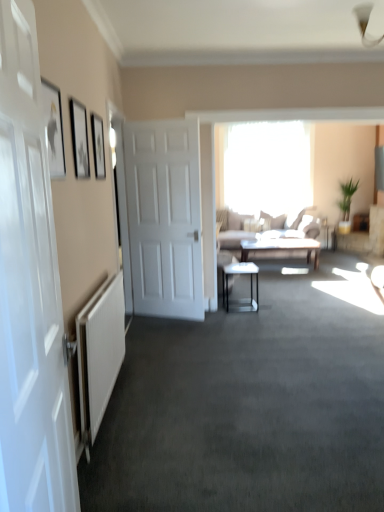
Question: Is light brown fabric couch at center wider or thinner than matte gray table at center, the second table from the bottom?

Choices:
 (A) thin
 (B) wide

Answer: (B)

Question: From the image's perspective, is light brown fabric couch at center positioned above or below matte gray table at center, marked as the first table in a right-to-left arrangement?

Choices:
 (A) above
 (B) below

Answer: (A)

Question: Which object is the farthest from the white matte door at center, the second door positioned from the front?

Choices:
 (A) transparent glass window at center
 (B) light brown fabric couch at center
 (C) matte black picture frame at upper left, which appears as the 2th picture frame when viewed from the front
 (D) white glossy door at left, the first door from the front
 (E) matte gray table at center, the second table positioned from the left

Answer: (A)

Question: Which object is positioned closest to the metallic glass table at center, which appears as the 1th table when viewed from the left?

Choices:
 (A) white textured radiator at lower left
 (B) matte black picture frame at upper left, the first picture frame from the back
 (C) matte gray table at center, which is the 1th table in top-to-bottom order
 (D) matte black picture frame at upper left, the third picture frame viewed from the back
 (E) matte black picture frame at upper left, which appears as the 2th picture frame when viewed from the front

Answer: (C)